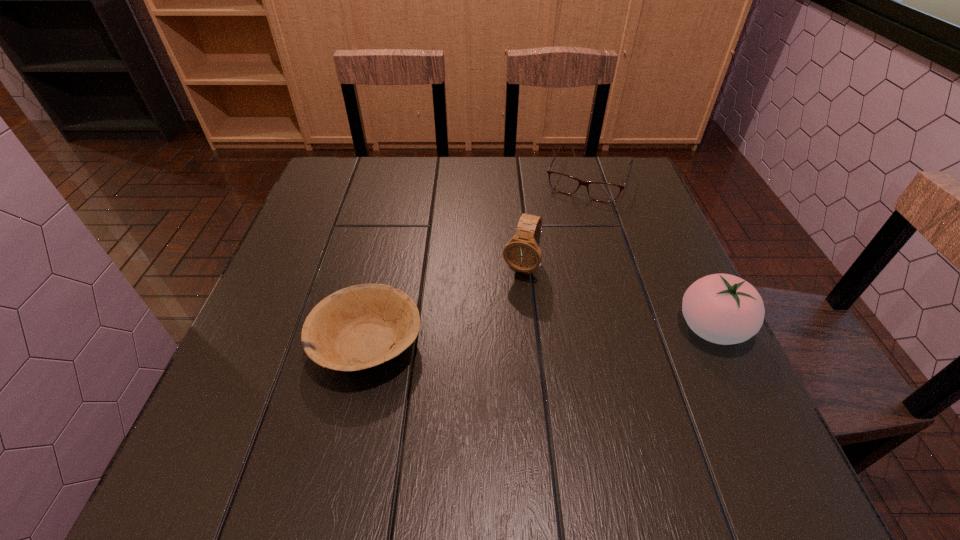
Find the location of `vacant space located on the lenses of the spectacles`. vacant space located on the lenses of the spectacles is located at coordinates (565, 232).

I want to click on vacant area located 0.070m on the lenses of the spectacles, so click(x=571, y=218).

You are a GUI agent. You are given a task and a screenshot of the screen. Output one action in this format:
    pyautogui.click(x=<x>, y=<y>)
    Task: Click on the free space located 0.340m on the lenses of the spectacles
    
    Given the screenshot: What is the action you would take?
    tap(540, 290)

Where is `object that is at the far edge`? object that is at the far edge is located at coordinates (599, 191).

What are the coordinates of `object that is positioned at the near edge` in the screenshot? It's located at (361, 326).

What are the coordinates of `object positioned at the left edge` in the screenshot? It's located at (361, 326).

Locate an element on the screen. The width and height of the screenshot is (960, 540). tomato at the right edge is located at coordinates [x=724, y=309].

Find the location of a particular element. The width and height of the screenshot is (960, 540). spectacles situated at the right edge is located at coordinates (599, 191).

You are a GUI agent. You are given a task and a screenshot of the screen. Output one action in this format:
    pyautogui.click(x=<x>, y=<y>)
    Task: Click on the object located in the near left corner section of the desktop
    Image resolution: width=960 pixels, height=540 pixels.
    Given the screenshot: What is the action you would take?
    pyautogui.click(x=361, y=326)

You are a GUI agent. You are given a task and a screenshot of the screen. Output one action in this format:
    pyautogui.click(x=<x>, y=<y>)
    Task: Click on the object that is at the far right corner
    Image resolution: width=960 pixels, height=540 pixels.
    Given the screenshot: What is the action you would take?
    pyautogui.click(x=599, y=191)